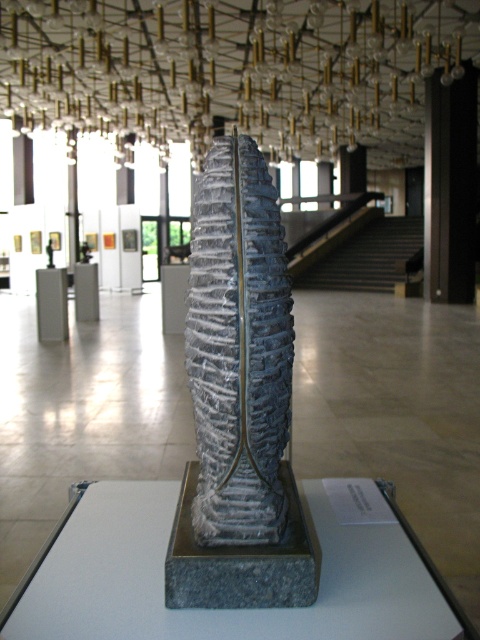
You are an art curator planning to move the black polished pillar at right closer to the entrance. However, there is a gray textured stone column at center blocking the path. Can you move the pillar around the column to reach the entrance without moving the column?

The gray textured stone column at center is in front of the black polished pillar at right, meaning the pillar is behind the column. To move the pillar around the column towards the entrance, you would need to navigate around the column either to its left or right side, provided there is enough space in the gallery to maneuver around it. Since the column is at the center, moving around it should be feasible as long as the path isn

You are an art curator planning to install a new light fixture between the gray textured stone column at center and the gray stone pillar at center. Since you want the light to shine equally on both, which object should the light be placed closer to?

The light fixture should be placed closer to the gray textured stone column at center because it is nearer to the viewer compared to the gray stone pillar at center. This placement ensures the light will illuminate both objects evenly from the front.

You are an interior designer planning to place a new piece of furniture between the gray textured stone column at center and the black polished pillar at right. Given their sizes, which object should the furniture be closer to for balance?

The gray textured stone column at center has a smaller size compared to black polished pillar at right, so the furniture should be placed closer to the larger black polished pillar at right to create visual balance.